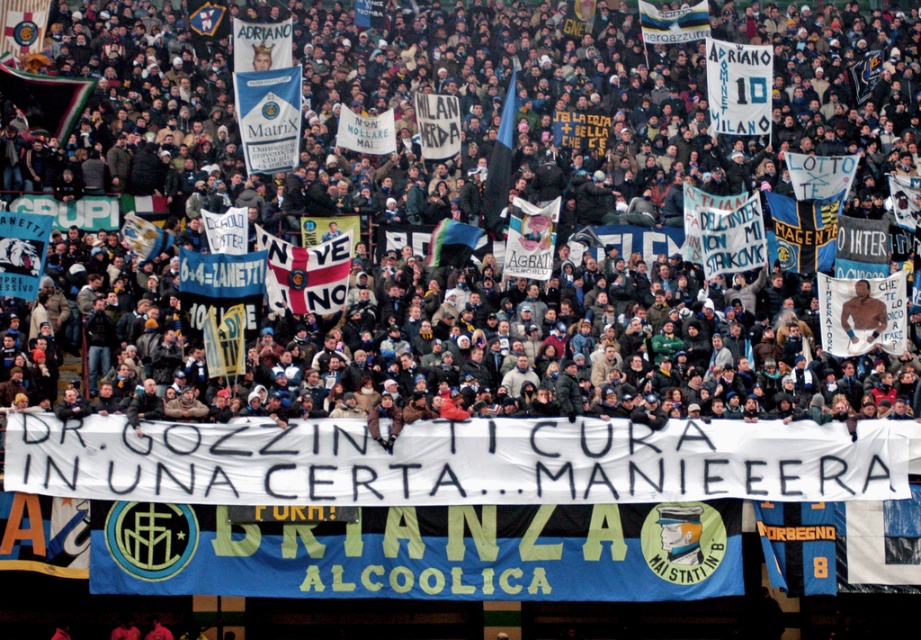
You are a photographer standing at the center of the stadium. You want to take a photo of the white paper banner at center. Where should you aim your camera?

You should aim your camera at point (x=723, y=230) to capture the white paper banner at center.